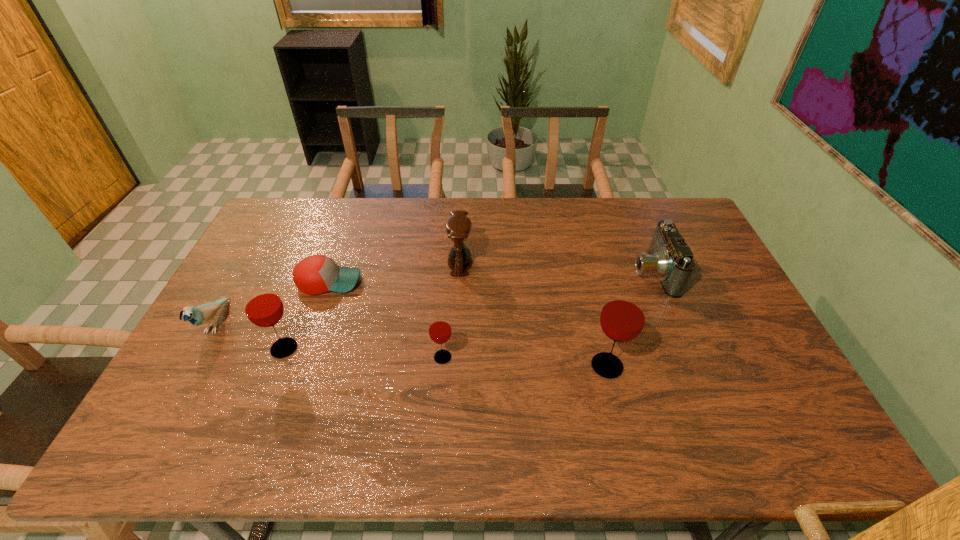
The width and height of the screenshot is (960, 540). I want to click on free space between the rightmost glass and the baseball cap, so click(468, 323).

Identify the location of vacant point located between the shortest glass and the bird. Image resolution: width=960 pixels, height=540 pixels. (329, 340).

I want to click on free area in between the shortest glass and the bird, so click(329, 340).

Locate which object is the third closest to the rightmost glass. Please provide its 2D coordinates. Your answer should be formatted as a tuple, i.e. [(x, y)], where the tuple contains the x and y coordinates of a point satisfying the conditions above.

[(458, 227)]

The image size is (960, 540). In order to click on object that can be found as the closest to the leftmost glass in this screenshot , I will do point(316,274).

Identify the location of glass that is the second nearest to the second tallest glass. The image size is (960, 540). (622, 319).

Image resolution: width=960 pixels, height=540 pixels. In order to click on glass that is the second nearest to the shortest glass in this screenshot , I will do `click(264, 308)`.

What are the coordinates of `vacant area that satisfies the following two spatial constraints: 1. on the front side of the second object from right to left; 2. on the right side of the hourglass` in the screenshot? It's located at (455, 366).

Locate an element on the screen. The height and width of the screenshot is (540, 960). vacant region that satisfies the following two spatial constraints: 1. at the face of the second glass from right to left; 2. on the left side of the bird is located at coordinates (197, 357).

This screenshot has height=540, width=960. In order to click on free space that satisfies the following two spatial constraints: 1. on the back side of the sixth object from left to right; 2. at the brim of the shortest object in this screenshot , I will do `click(586, 281)`.